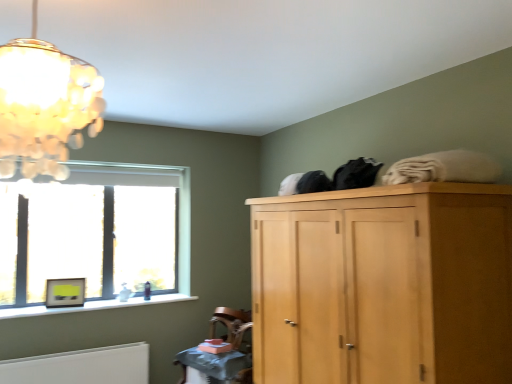
Question: Does wooden textured table at lower center appear on the right side of matte yellow picture frame at window?

Choices:
 (A) no
 (B) yes

Answer: (B)

Question: Does wooden textured table at lower center have a greater height compared to matte yellow picture frame at window?

Choices:
 (A) yes
 (B) no

Answer: (B)

Question: Is wooden textured table at lower center closer to camera compared to matte yellow picture frame at window?

Choices:
 (A) no
 (B) yes

Answer: (B)

Question: From the image's perspective, is wooden textured table at lower center below matte yellow picture frame at window?

Choices:
 (A) no
 (B) yes

Answer: (B)

Question: Is wooden textured table at lower center not near matte yellow picture frame at window?

Choices:
 (A) no
 (B) yes

Answer: (B)

Question: In the image, is translucent glass chandelier at upper left on the left side or the right side of wooden textured table at lower center?

Choices:
 (A) right
 (B) left

Answer: (B)

Question: Is translucent glass chandelier at upper left in front of or behind wooden textured table at lower center in the image?

Choices:
 (A) behind
 (B) front

Answer: (B)

Question: Considering the positions of translucent glass chandelier at upper left and wooden textured table at lower center in the image, is translucent glass chandelier at upper left bigger or smaller than wooden textured table at lower center?

Choices:
 (A) big
 (B) small

Answer: (A)

Question: Is translucent glass chandelier at upper left spatially inside wooden textured table at lower center, or outside of it?

Choices:
 (A) outside
 (B) inside

Answer: (A)

Question: From a real-world perspective, is translucent glass chandelier at upper left physically located above or below light wood wardrobe at upper right?

Choices:
 (A) below
 (B) above

Answer: (B)

Question: Is translucent glass chandelier at upper left in front of or behind light wood wardrobe at upper right in the image?

Choices:
 (A) front
 (B) behind

Answer: (A)

Question: In terms of size, does translucent glass chandelier at upper left appear bigger or smaller than light wood wardrobe at upper right?

Choices:
 (A) small
 (B) big

Answer: (A)

Question: Is translucent glass chandelier at upper left wider or thinner than light wood wardrobe at upper right?

Choices:
 (A) wide
 (B) thin

Answer: (B)

Question: From the image's perspective, is wooden textured table at lower center above or below clear glass window at left?

Choices:
 (A) above
 (B) below

Answer: (B)

Question: Is wooden textured table at lower center in front of or behind clear glass window at left in the image?

Choices:
 (A) front
 (B) behind

Answer: (A)